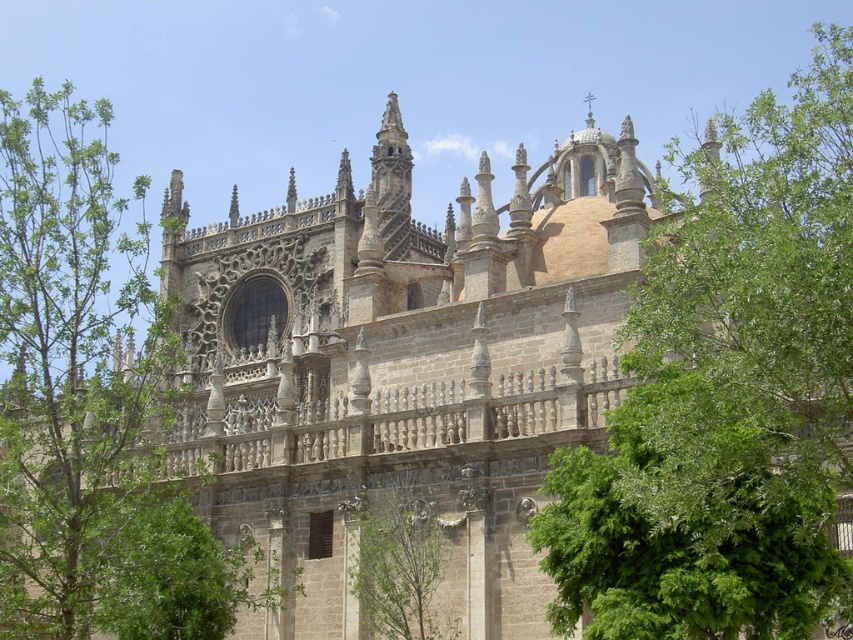
You are an architect analyzing the cathedral facade. You observe the green leafy tree at upper right and the green leafy tree at center. Which tree appears wider from your viewpoint?

The green leafy tree at upper right appears wider than the green leafy tree at center.